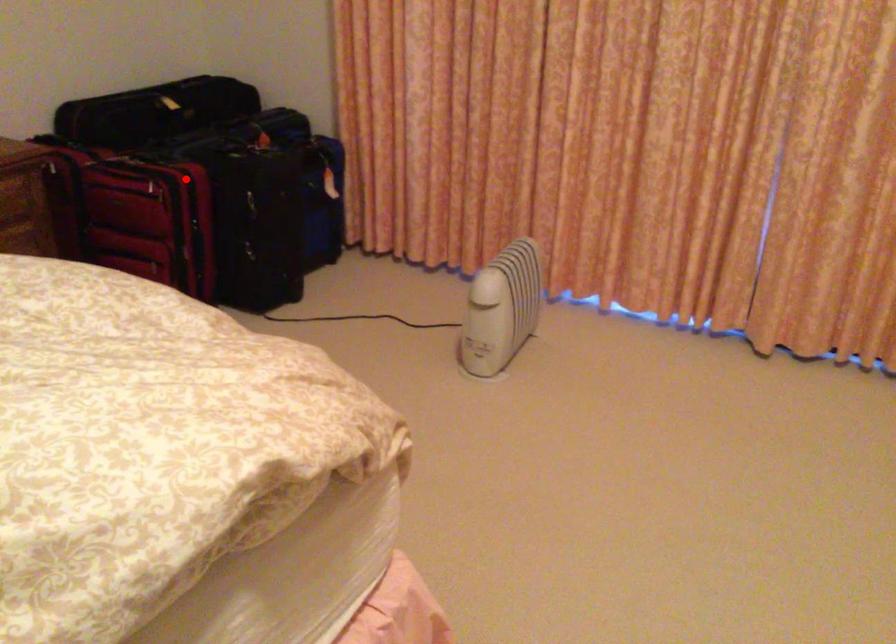
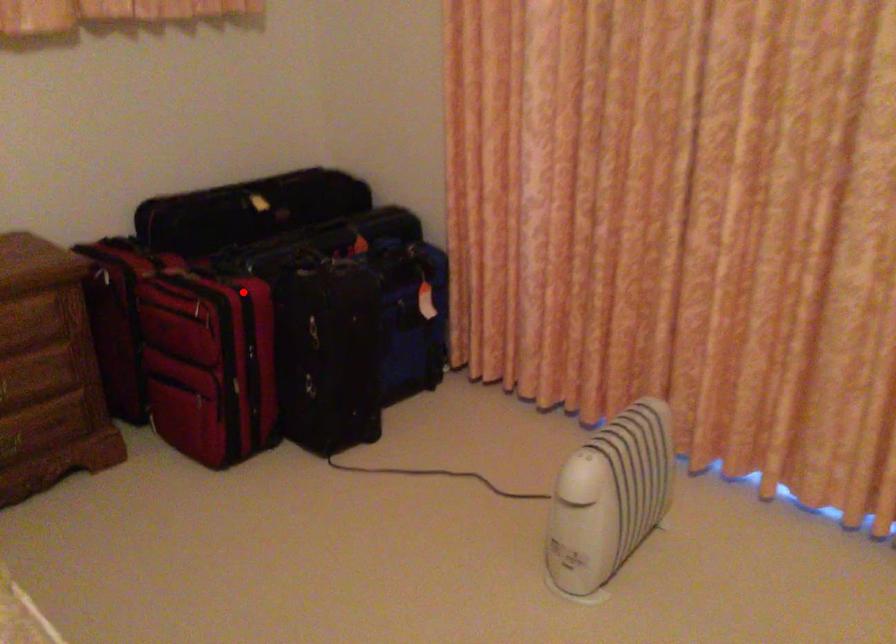
I am providing you with two images of the same scene from different viewpoints. A red point is marked on the first image and another point is marked on the second image. Is the marked point in image1 the same physical position as the marked point in image2?

Yes